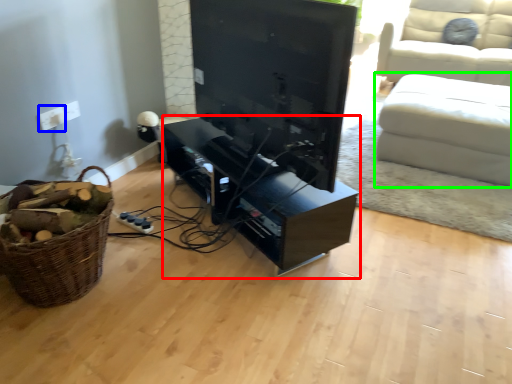
Question: Considering the real-world distances, which object is farthest from entertainment center (highlighted by a red box)? electric outlet (highlighted by a blue box) or studio couch (highlighted by a green box)?

Choices:
 (A) electric outlet
 (B) studio couch

Answer: (B)